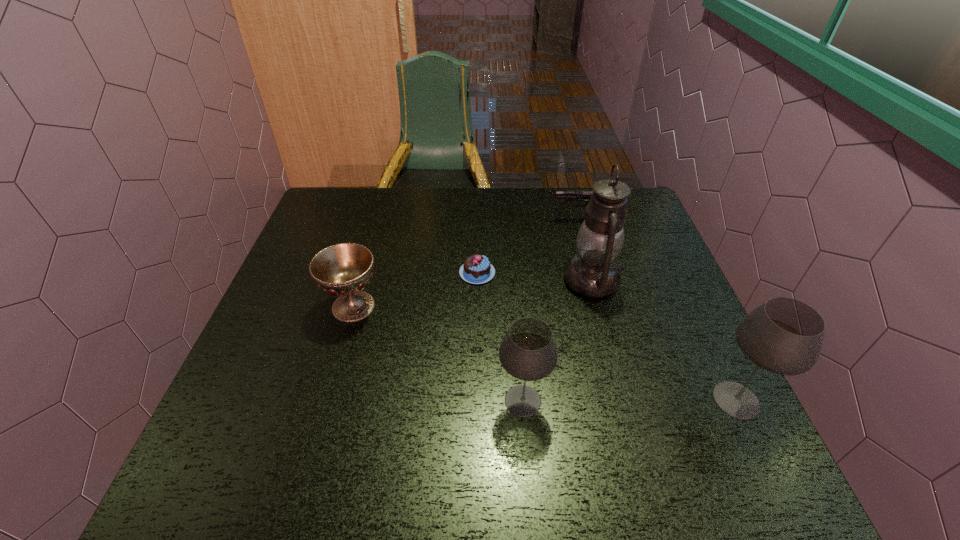
Where is `vacant area located 0.220m on the right of the fourth shortest object`? This screenshot has height=540, width=960. vacant area located 0.220m on the right of the fourth shortest object is located at coordinates (657, 401).

In order to click on vacant space situated on the left of the taller wineglass in this screenshot , I will do `click(567, 400)`.

Find the location of a particular element. The image size is (960, 540). free space located 0.330m aim along the barrel of the pistol is located at coordinates (445, 219).

This screenshot has width=960, height=540. In order to click on vacant space located 0.110m aim along the barrel of the pistol in this screenshot , I will do `click(516, 219)`.

This screenshot has width=960, height=540. I want to click on free space located aim along the barrel of the pistol, so 491,219.

Identify the location of free point located on the back of the third shortest object. This screenshot has width=960, height=540. (383, 204).

Locate an element on the screen. Image resolution: width=960 pixels, height=540 pixels. blank space located 0.140m on the back of the tallest object is located at coordinates (578, 227).

Identify the location of vacant area located on the back of the chocolate cake. (478, 198).

Locate an element on the screen. This screenshot has height=540, width=960. object that is at the far edge is located at coordinates (560, 195).

Identify the location of object situated at the left edge. This screenshot has height=540, width=960. (344, 269).